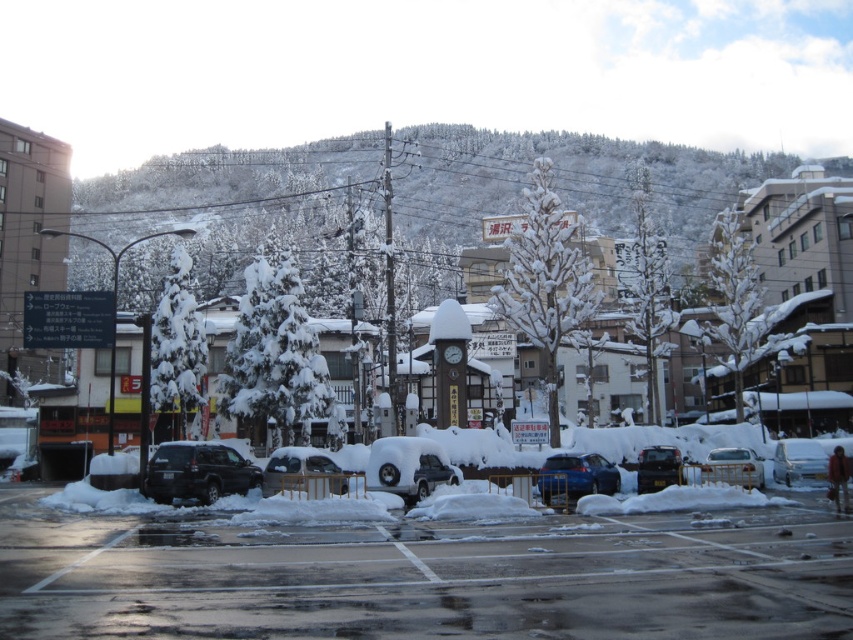
Question: Is metallic silver sedan at center to the right of white matte car at center from the viewer's perspective?

Choices:
 (A) yes
 (B) no

Answer: (A)

Question: Which point is closer to the camera taking this photo?

Choices:
 (A) (718, 467)
 (B) (393, 490)
 (C) (776, 470)
 (D) (346, 483)

Answer: (D)

Question: Can you confirm if sleek silver sedan at center is positioned to the right of metallic silver sedan at center?

Choices:
 (A) yes
 (B) no

Answer: (B)

Question: Does sleek silver sedan at center appear under metallic blue sedan at center?

Choices:
 (A) no
 (B) yes

Answer: (A)

Question: Among these points, which one is nearest to the camera?

Choices:
 (A) (711, 481)
 (B) (816, 481)
 (C) (222, 456)
 (D) (402, 438)

Answer: (A)

Question: Which object is the farthest from the white matte car at center?

Choices:
 (A) matte black suv at center
 (B) snow-covered suv at center
 (C) sleek silver sedan at center

Answer: (A)